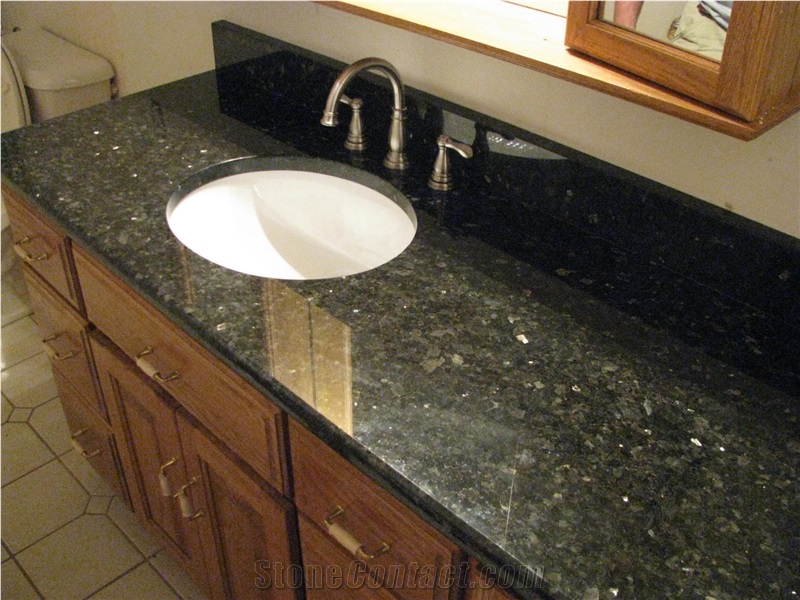
At what (x,y) coordinates should I click in order to perform the action: click on mirror. Please return your answer as a coordinate pair (x, y). This screenshot has height=600, width=800. Looking at the image, I should click on (720, 23).